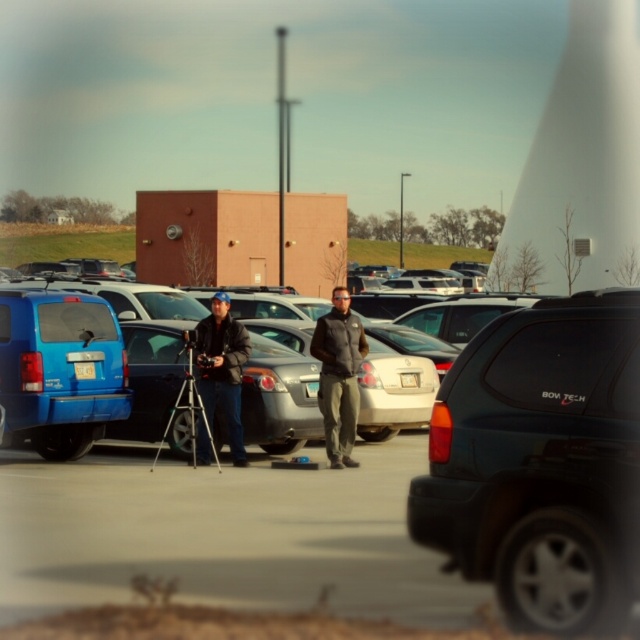
Question: In this image, where is matte black suv at center located relative to blue matte van at center?

Choices:
 (A) above
 (B) below

Answer: (B)

Question: Which point is closer to the camera?

Choices:
 (A) silver metallic tripod at center
 (B) matte black suv at center
 (C) matte blue van at left
 (D) blue matte van at center

Answer: (B)

Question: Which of these objects is positioned farthest from the matte black jacket at center?

Choices:
 (A) silver metallic tripod at center
 (B) matte black suv at center
 (C) blue matte van at center
 (D) dark gray fleece jacket at center

Answer: (B)

Question: Does blue matte van at center have a greater width compared to matte black jacket at center?

Choices:
 (A) yes
 (B) no

Answer: (A)

Question: Does metallic silver car at center have a lesser width compared to matte black jacket at center?

Choices:
 (A) yes
 (B) no

Answer: (B)

Question: Which object is closer to the camera taking this photo?

Choices:
 (A) blue matte van at center
 (B) matte black jacket at center

Answer: (B)